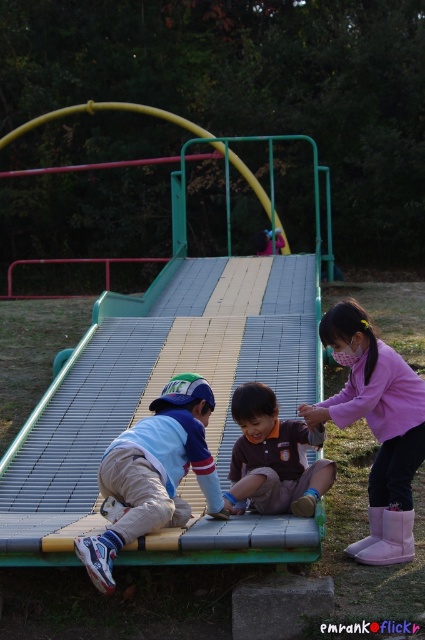
Is the position of pink fabric mask at upper right more distant than that of brown fabric shirt at center?

Yes, it is behind brown fabric shirt at center.

Does point (305, 416) lie in front of point (274, 470)?

No, (305, 416) is further to viewer.

At what (x,y) coordinates should I click in order to perform the action: click on pink fabric mask at upper right. Please return your answer as a coordinate pair (x, y). Image resolution: width=425 pixels, height=640 pixels. Looking at the image, I should click on (376, 428).

Can you confirm if pink fabric mask at upper right is positioned to the left of light blue fabric shirt at center?

Incorrect, pink fabric mask at upper right is not on the left side of light blue fabric shirt at center.

The image size is (425, 640). Identify the location of pink fabric mask at upper right. (376, 428).

Does light blue fabric shirt at center appear under brown fabric shirt at center?

Correct, light blue fabric shirt at center is located below brown fabric shirt at center.

Who is positioned more to the left, light blue fabric shirt at center or brown fabric shirt at center?

light blue fabric shirt at center is more to the left.

The height and width of the screenshot is (640, 425). I want to click on light blue fabric shirt at center, so click(153, 474).